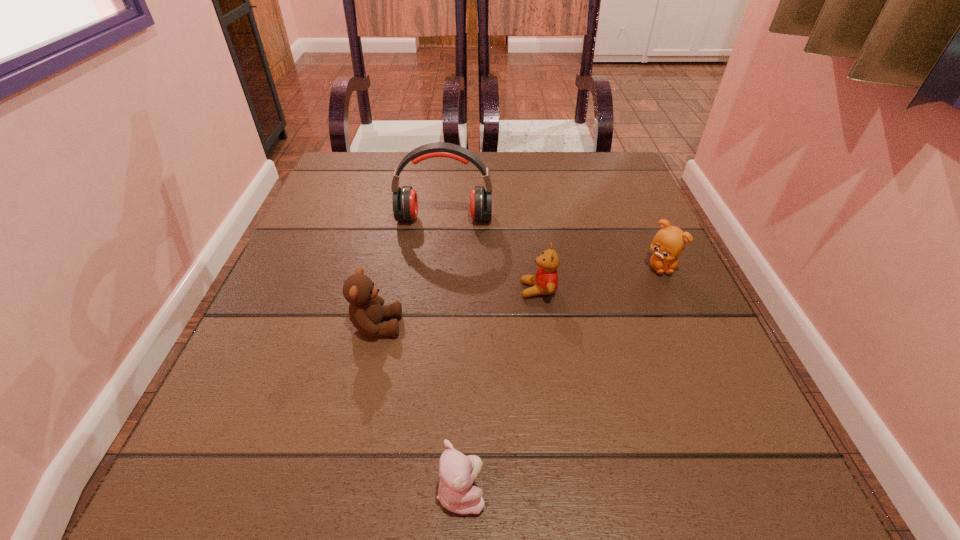
At what (x,y) coordinates should I click in order to perform the action: click on free space that satisfies the following two spatial constraints: 1. on the face of the rightmost teddy bear; 2. at the face of the second teddy bear from left to right. Please return your answer as a coordinate pair (x, y). Looking at the image, I should click on (760, 491).

This screenshot has height=540, width=960. I want to click on free spot that satisfies the following two spatial constraints: 1. on the face of the rightmost teddy bear; 2. on the front-facing side of the third teddy bear from left to right, so click(670, 290).